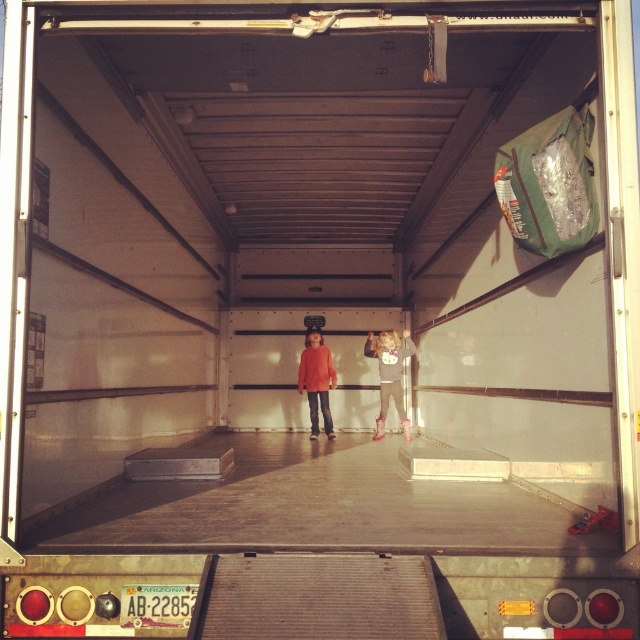
Question: Which point is farther to the camera?

Choices:
 (A) matte gray sweater at center
 (B) matte orange sweater at center

Answer: (B)

Question: Is matte gray sweater at center bigger than matte orange sweater at center?

Choices:
 (A) no
 (B) yes

Answer: (B)

Question: Is matte gray sweater at center wider than matte orange sweater at center?

Choices:
 (A) yes
 (B) no

Answer: (A)

Question: Can you confirm if matte gray sweater at center is smaller than matte orange sweater at center?

Choices:
 (A) yes
 (B) no

Answer: (B)

Question: Which of the following is the farthest from the observer?

Choices:
 (A) (406, 429)
 (B) (310, 362)

Answer: (B)